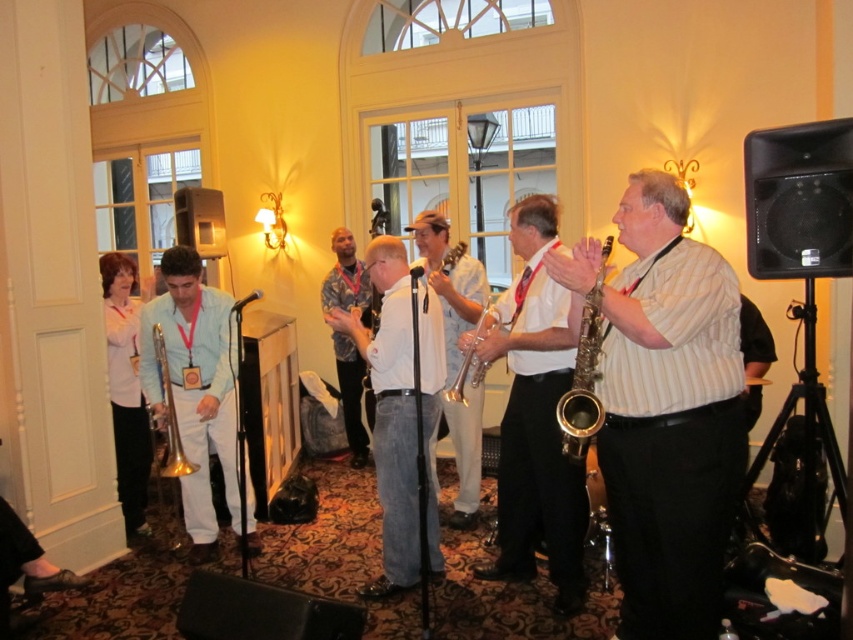
You are a photographer trying to capture a closeup of the matte gold saxophone at center without including the white shirt at center in the frame. Is this possible given their spatial relationship?

The matte gold saxophone at center occupies less space than the white shirt at center, so it is possible to capture a closeup of the matte gold saxophone at center without including the white shirt at center in the frame by focusing on the smaller area it occupies.

You are a photographer capturing the performance. You notice the matte gold saxophone at center and the white shirt at center. Which object is closer to the camera?

The white shirt at center is closer to the camera because the matte gold saxophone at center is positioned under it.

You are a photographer standing at the back of the room. You want to take a photo of the white shirt at center and the gold brass trumpet at left. Which object will appear larger in the photo?

The white shirt at center will appear larger in the photo because it is bigger than the gold brass trumpet at left.